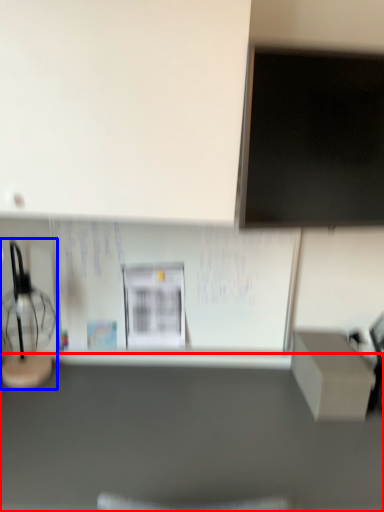
Question: Which point is closer to the camera, furniture (highlighted by a red box) or table lamp (highlighted by a blue box)?

Choices:
 (A) furniture
 (B) table lamp

Answer: (A)